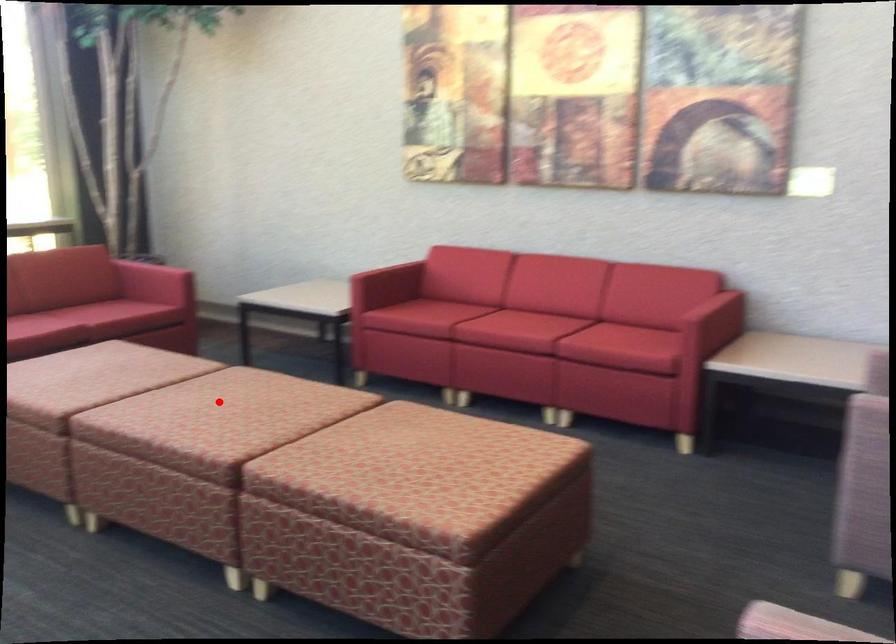
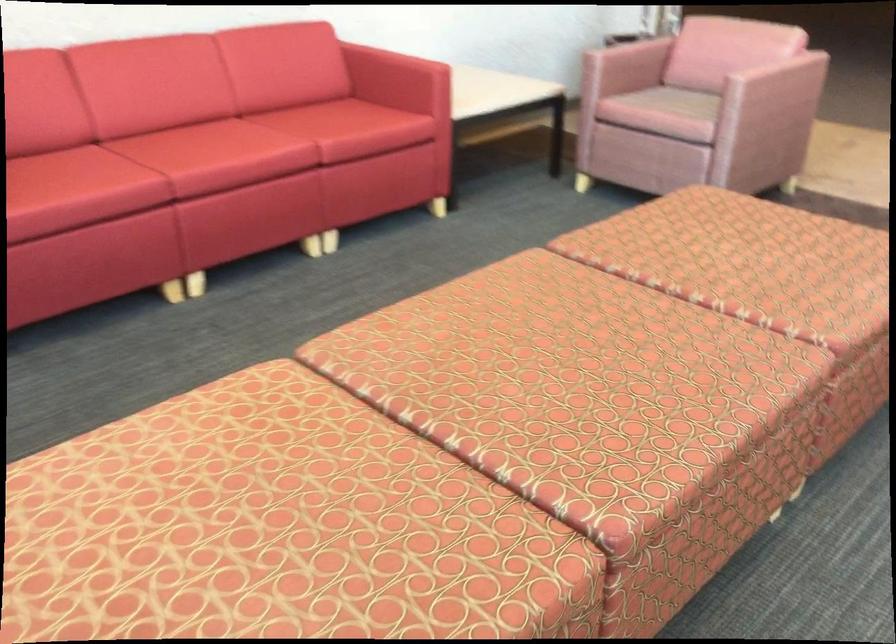
Question: A red point is marked in image1. In image2, is the corresponding 3D point closer to the camera or farther? Reply with the corresponding letter.

Choices:
 (A) The corresponding 3D point is closer.
 (B) The corresponding 3D point is farther.

Answer: (A)